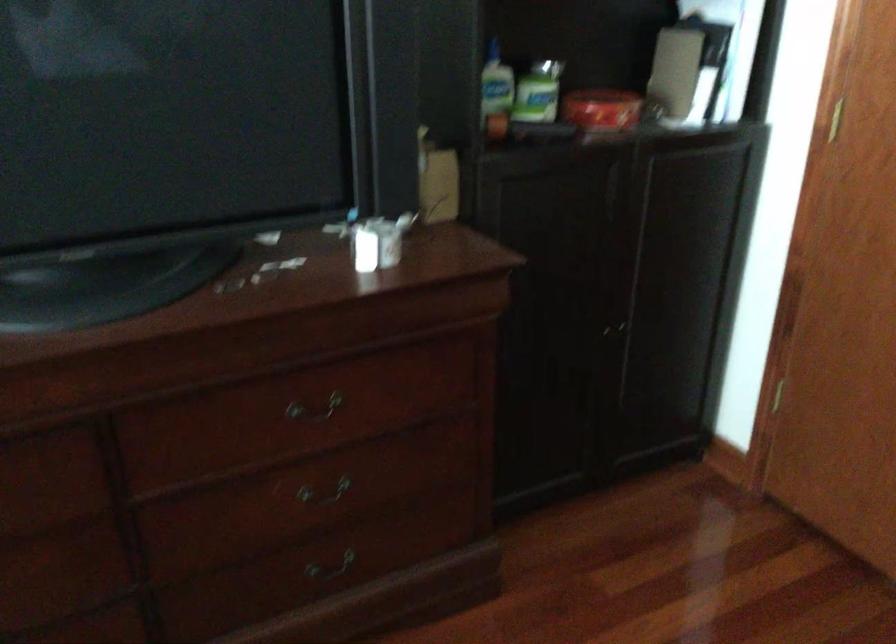
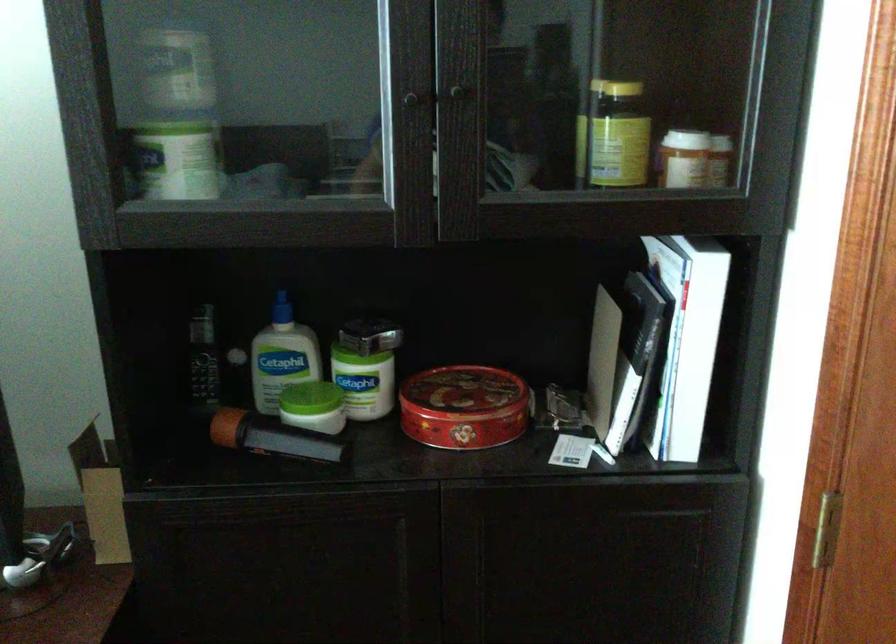
Locate, in the second image, the point that corresponds to point 747,174 in the first image.

(707, 554)